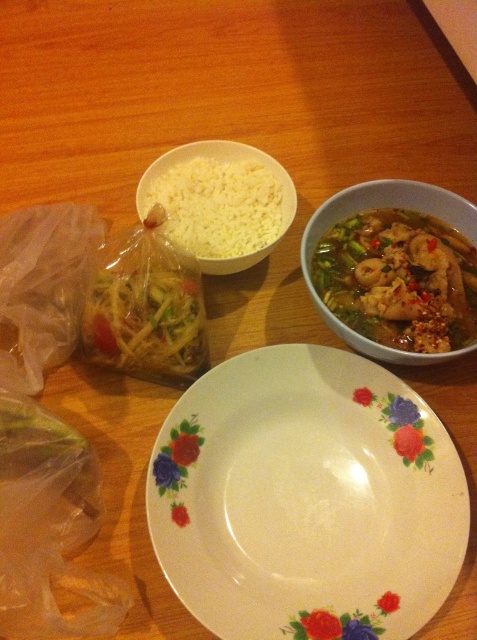
Is white ceramic plate at center below white matte bowl at upper center?

Correct, white ceramic plate at center is located below white matte bowl at upper center.

Who is lower down, white ceramic plate at center or white matte bowl at upper center?

Positioned lower is white ceramic plate at center.

Which is in front, point (300, 512) or point (272, 225)?

Point (300, 512)

Where is `white ceramic plate at center`? The image size is (477, 640). white ceramic plate at center is located at coordinates (307, 499).

Is the position of white matte bowl at upper center more distant than that of semi-translucent ceramic bowl at upper right?

Yes, white matte bowl at upper center is behind semi-translucent ceramic bowl at upper right.

Which is more to the right, white matte bowl at upper center or semi-translucent ceramic bowl at upper right?

semi-translucent ceramic bowl at upper right is more to the right.

Does point (186, 216) come in front of point (304, 264)?

No, it is behind (304, 264).

This screenshot has width=477, height=640. Find the location of `white matte bowl at upper center`. white matte bowl at upper center is located at coordinates (224, 198).

Can you confirm if white matte bowl at upper center is wider than slightly translucent plastic bag at center-left?

Indeed, white matte bowl at upper center has a greater width compared to slightly translucent plastic bag at center-left.

Who is higher up, white matte bowl at upper center or slightly translucent plastic bag at center-left?

white matte bowl at upper center is above.

What do you see at coordinates (224, 198) in the screenshot? This screenshot has height=640, width=477. I see `white matte bowl at upper center` at bounding box center [224, 198].

You are a GUI agent. You are given a task and a screenshot of the screen. Output one action in this format:
    pyautogui.click(x=<x>, y=<y>)
    Task: Click on the white matte bowl at upper center
    
    Given the screenshot: What is the action you would take?
    [224, 198]